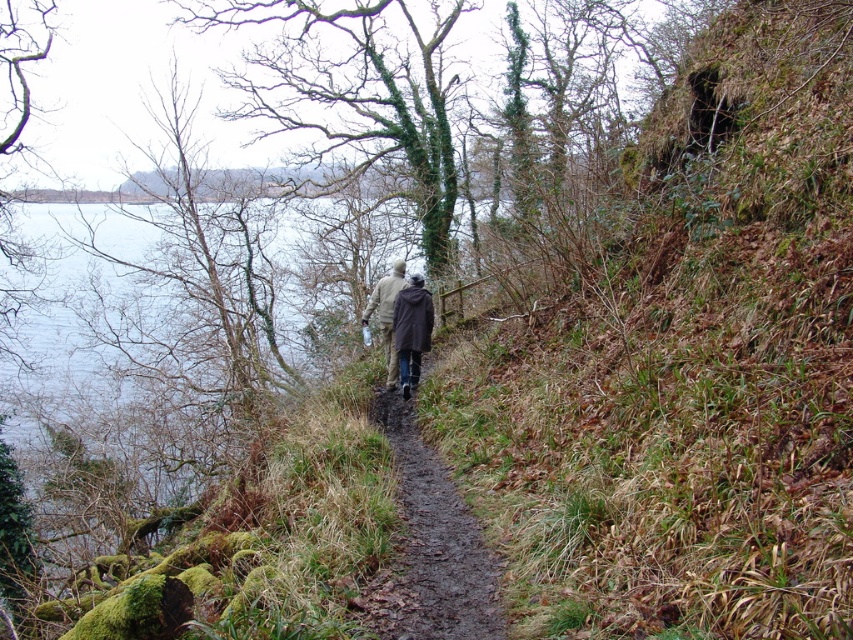
You are a hiker trying to cross the brown dirt path at center while wearing the dark brown leather jacket at center. Can you walk through the path without bending down?

The brown dirt path at center is shorter than the dark brown leather jacket at center, so the jacket might hit the surrounding vegetation or branches, making it difficult to walk through without bending down.

You are standing on the brown dirt path at center and want to reach the dark brown leather jacket at center. Which direction should you move to get closer to the jacket?

The brown dirt path at center is closer to the viewer than the dark brown leather jacket at center, so you should move forward along the brown dirt path at center to get closer to the jacket.